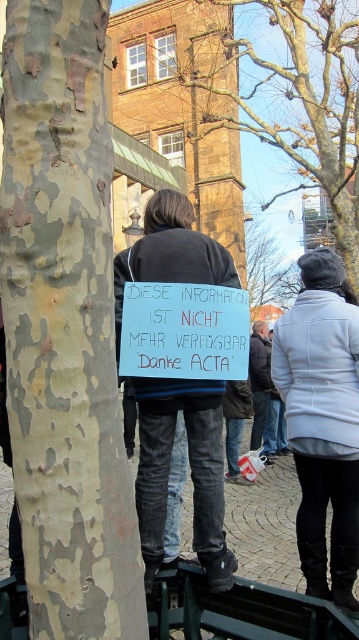
Question: Which object is closer to the camera taking this photo?

Choices:
 (A) camouflage bark tree at center
 (B) smooth bark tree at upper center

Answer: (A)

Question: Is denim jeans at center to the left of dark gray jacket at center from the viewer's perspective?

Choices:
 (A) yes
 (B) no

Answer: (A)

Question: Does denim jeans at center appear on the right side of dark gray jacket at center?

Choices:
 (A) yes
 (B) no

Answer: (B)

Question: Which is farther from the light gray wool coat at lower right?

Choices:
 (A) denim jeans at center
 (B) camouflage bark tree at center

Answer: (B)

Question: Is greenish-brown textured bark at left closer to camera compared to camouflage bark tree at center?

Choices:
 (A) no
 (B) yes

Answer: (B)

Question: Based on their relative distances, which object is farther from the light gray wool coat at lower right?

Choices:
 (A) smooth bark tree at upper center
 (B) camouflage bark tree at center
 (C) greenish-brown textured bark at left

Answer: (A)